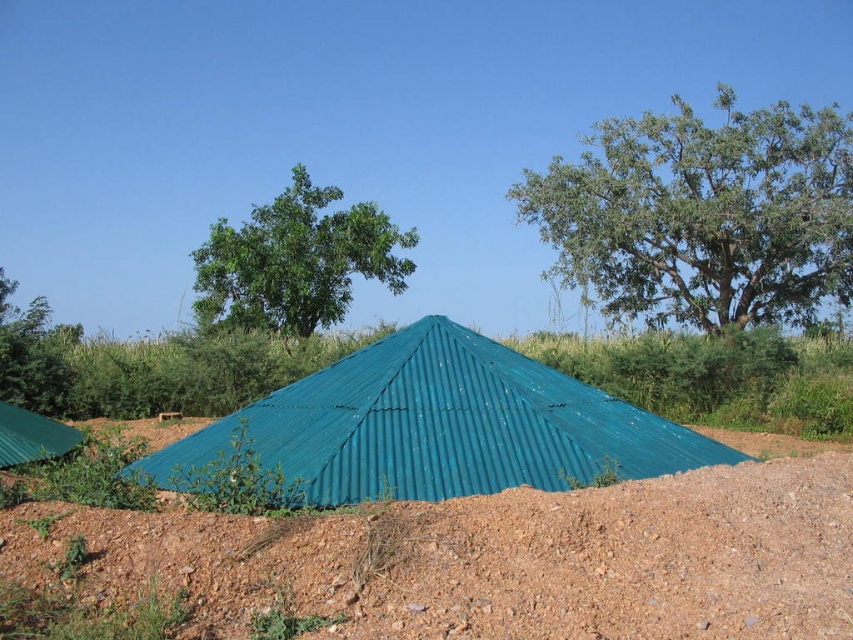
Question: Can you confirm if green leafy tree at upper right is positioned to the left of green leafy tree at upper left?

Choices:
 (A) no
 (B) yes

Answer: (A)

Question: Is green leafy tree at upper right positioned behind teal corrugated metal tent at center?

Choices:
 (A) no
 (B) yes

Answer: (B)

Question: Which of these objects is positioned closest to the green leafy tree at upper left?

Choices:
 (A) teal corrugated metal tent at center
 (B) brown gravelly dirt at center

Answer: (B)

Question: Estimate the real-world distances between objects in this image. Which object is farther from the green leafy tree at upper right?

Choices:
 (A) teal corrugated metal tent at center
 (B) green leafy tree at left
 (C) brown gravelly dirt at center
 (D) green leafy tree at upper left

Answer: (A)

Question: Is teal corrugated metal tent at center bigger than green leafy tree at left?

Choices:
 (A) no
 (B) yes

Answer: (A)

Question: Which object is closer to the camera taking this photo?

Choices:
 (A) green leafy tree at upper left
 (B) teal corrugated metal tent at center
 (C) green leafy tree at upper right

Answer: (B)